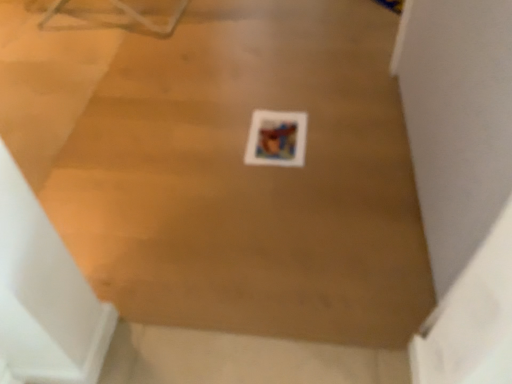
In order to click on empty space that is to the right of matte paper print at center in this screenshot , I will do `click(339, 133)`.